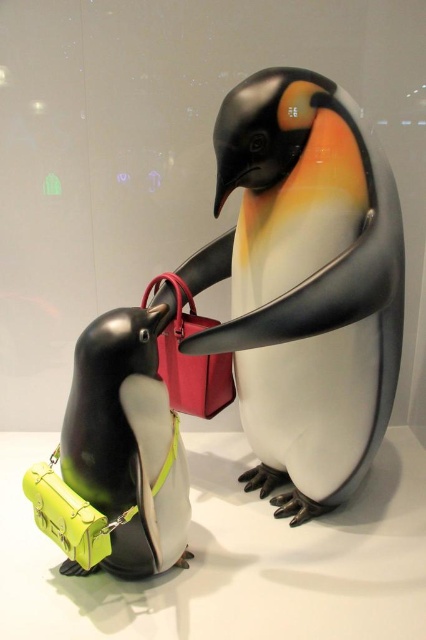
Question: Can you confirm if glossy plastic penguin at center is wider than matte red leather handbag at center?

Choices:
 (A) yes
 (B) no

Answer: (A)

Question: Does glossy plastic penguin at center have a greater width compared to matte red leather handbag at center?

Choices:
 (A) no
 (B) yes

Answer: (B)

Question: Which point is farther to the camera?

Choices:
 (A) matte red leather handbag at center
 (B) glossy plastic penguin at center
 (C) matte green leather bag at lower left

Answer: (A)

Question: Which point appears farthest from the camera in this image?

Choices:
 (A) (193, 380)
 (B) (121, 561)
 (C) (296, 440)

Answer: (A)

Question: From the image, what is the correct spatial relationship of glossy plastic penguin at center in relation to matte green leather bag at lower left?

Choices:
 (A) left
 (B) right

Answer: (B)

Question: Which point is closer to the camera?

Choices:
 (A) (172, 364)
 (B) (66, 474)

Answer: (B)